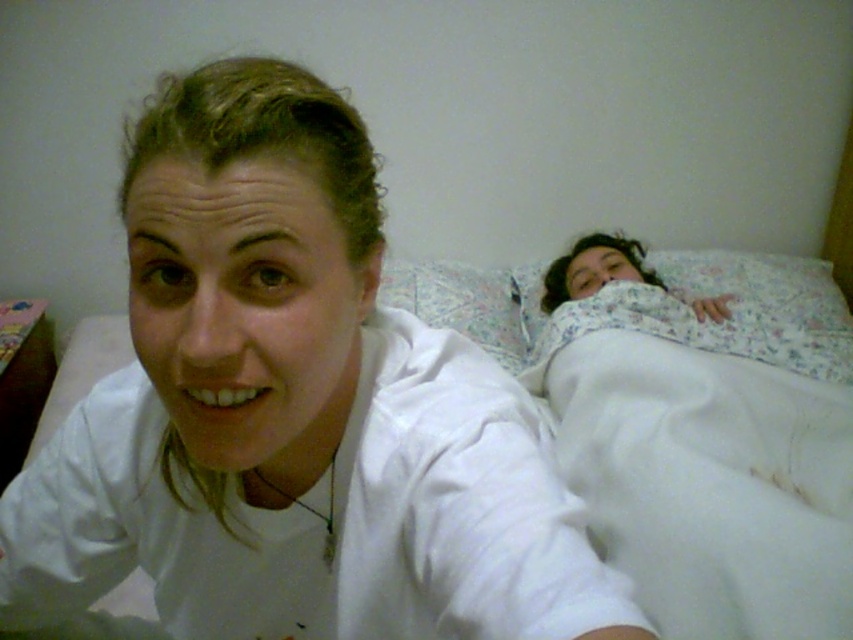
Question: Is white matte shirt at center closer to camera compared to white soft fabric at upper right?

Choices:
 (A) yes
 (B) no

Answer: (A)

Question: Which object is closer to the camera taking this photo?

Choices:
 (A) white matte shirt at center
 (B) white soft fabric at upper right

Answer: (A)

Question: Which point is farther to the camera?

Choices:
 (A) (587, 243)
 (B) (227, 248)

Answer: (A)

Question: Can you confirm if white matte shirt at center is positioned to the right of white soft fabric at upper right?

Choices:
 (A) yes
 (B) no

Answer: (B)

Question: Is white matte shirt at center to the right of white soft fabric at upper right from the viewer's perspective?

Choices:
 (A) yes
 (B) no

Answer: (B)

Question: Which point is closer to the camera?

Choices:
 (A) (567, 264)
 (B) (253, 385)

Answer: (B)